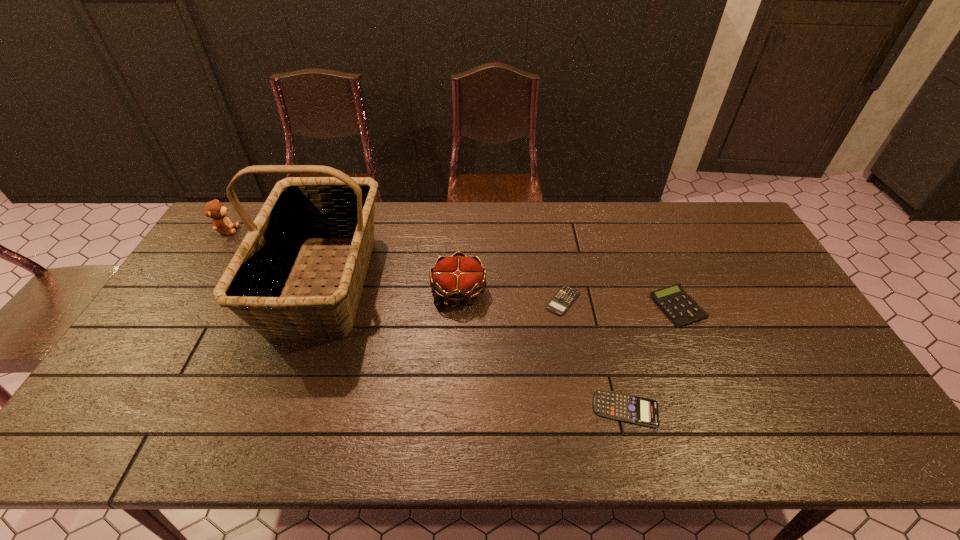
Where is `object that is at the left edge`? This screenshot has width=960, height=540. object that is at the left edge is located at coordinates (214, 209).

I want to click on object situated at the far left corner, so click(x=214, y=209).

I want to click on vacant area at the far edge, so click(x=542, y=240).

Find the location of a particular element. The height and width of the screenshot is (540, 960). free space at the near edge of the desktop is located at coordinates (463, 440).

This screenshot has height=540, width=960. What are the coordinates of `vacant space at the left edge of the desktop` in the screenshot? It's located at (164, 384).

Where is `vacant space at the near left corner of the desktop`? The width and height of the screenshot is (960, 540). vacant space at the near left corner of the desktop is located at coordinates (122, 444).

Locate an element on the screen. unoccupied position between the crown and the nearest calculator is located at coordinates (542, 350).

Where is `vacant space in between the shortest object and the teddy bear`? The height and width of the screenshot is (540, 960). vacant space in between the shortest object and the teddy bear is located at coordinates (396, 265).

Find the location of a particular element. The height and width of the screenshot is (540, 960). vacant space that's between the second shortest object and the shortest calculator is located at coordinates (594, 355).

This screenshot has height=540, width=960. What are the coordinates of `free space between the nearest object and the crown` in the screenshot? It's located at (542, 350).